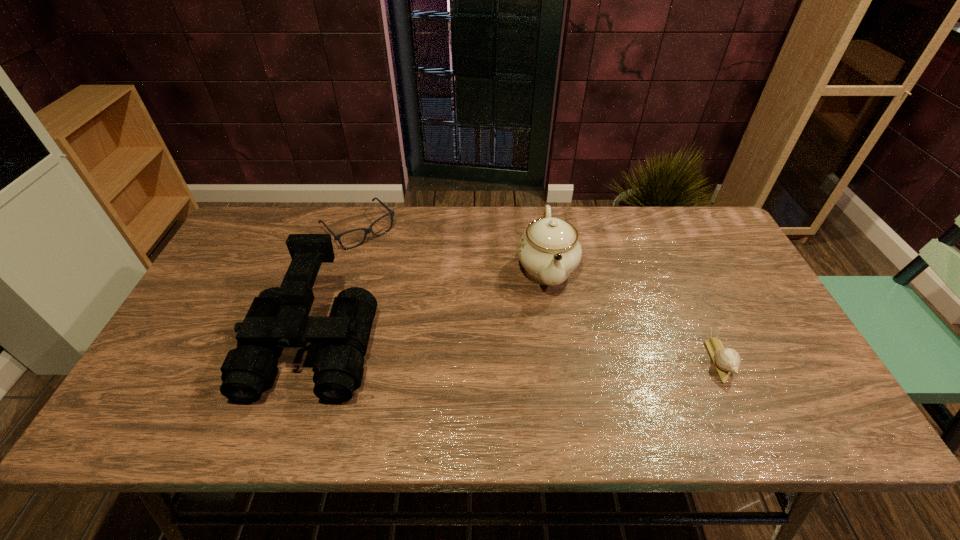
Identify the location of vacant space on the desktop that is between the binoculars and the escargot and is positioned on the front-facing side of the spectacles. (476, 350).

Find the location of `free space on the desktop that is between the tallest object and the rightmost object and is positioned at the spout of the second tallest object`. free space on the desktop that is between the tallest object and the rightmost object and is positioned at the spout of the second tallest object is located at coordinates (558, 353).